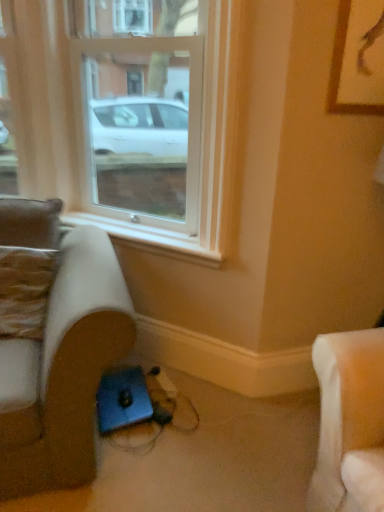
Question: Is clear glass window at center spatially inside white plastic window sill at lower center, or outside of it?

Choices:
 (A) inside
 (B) outside

Answer: (B)

Question: Looking at their shapes, would you say clear glass window at center is wider or thinner than white plastic window sill at lower center?

Choices:
 (A) thin
 (B) wide

Answer: (B)

Question: Which is farther from the suede-like beige studio couch at lower left?

Choices:
 (A) clear glass window at center
 (B) wooden framed picture at upper right
 (C) white plastic window sill at lower center
 (D) leather-like brown pillow at left

Answer: (B)

Question: Estimate the real-world distances between objects in this image. Which object is closer to the clear glass window at center?

Choices:
 (A) suede-like beige studio couch at lower left
 (B) white plastic window sill at lower center
 (C) leather-like brown pillow at left
 (D) wooden framed picture at upper right

Answer: (B)